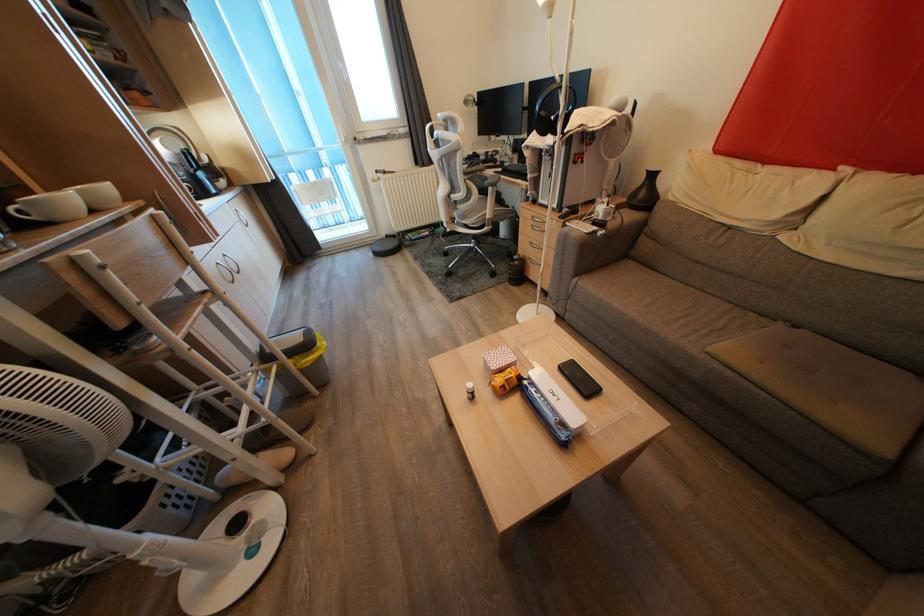
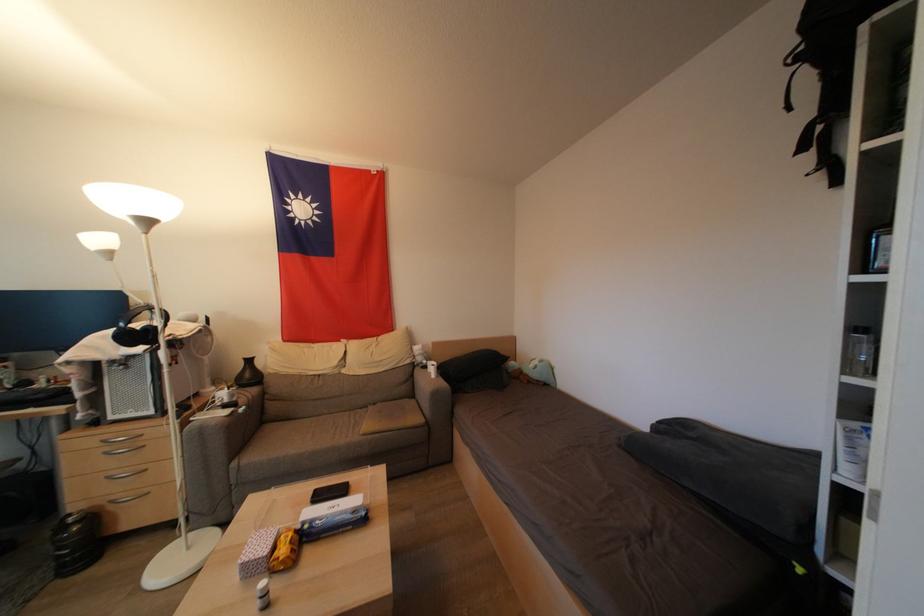
Find the pixel in the second image that matches (x=528, y=265) in the first image.

(99, 521)